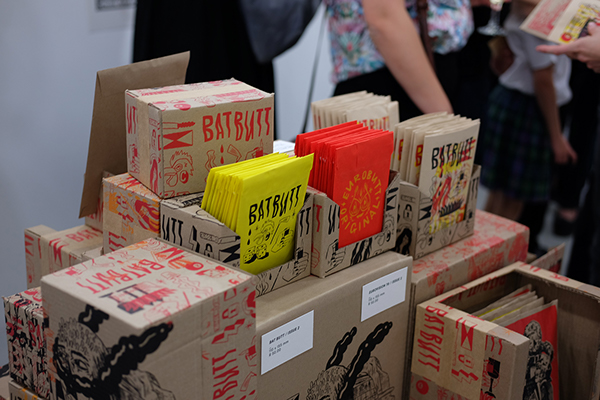
Identify the location of boxes. (131, 281), (198, 113), (144, 208), (68, 243), (198, 228), (450, 366), (470, 247), (356, 336).